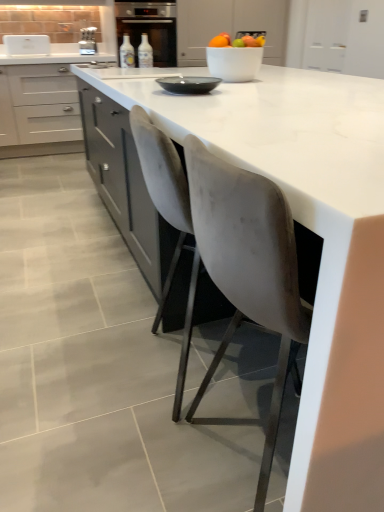
Question: Does metallic silver toaster at upper left turn towards matte black bowl at center?

Choices:
 (A) no
 (B) yes

Answer: (B)

Question: Is metallic silver toaster at upper left positioned beyond the bounds of matte black bowl at center?

Choices:
 (A) yes
 (B) no

Answer: (A)

Question: Is metallic silver toaster at upper left taller than matte black bowl at center?

Choices:
 (A) no
 (B) yes

Answer: (B)

Question: Is metallic silver toaster at upper left to the left of matte black bowl at center from the viewer's perspective?

Choices:
 (A) no
 (B) yes

Answer: (B)

Question: Considering the relative positions of metallic silver toaster at upper left and matte black bowl at center in the image provided, is metallic silver toaster at upper left to the right of matte black bowl at center from the viewer's perspective?

Choices:
 (A) no
 (B) yes

Answer: (A)

Question: From the image's perspective, is white glossy bowl at upper center positioned above or below translucent glass bottle at center, the second bottle from the right?

Choices:
 (A) below
 (B) above

Answer: (A)

Question: Considering their positions, is white glossy bowl at upper center located in front of or behind translucent glass bottle at center, the first bottle positioned from the left?

Choices:
 (A) front
 (B) behind

Answer: (A)

Question: Based on their positions, is white glossy bowl at upper center located to the left or right of translucent glass bottle at center, the second bottle from the right?

Choices:
 (A) right
 (B) left

Answer: (A)

Question: From a real-world perspective, is white glossy bowl at upper center physically located above or below translucent glass bottle at center, the second bottle from the right?

Choices:
 (A) above
 (B) below

Answer: (B)

Question: Considering the positions of point (147, 38) and point (178, 76), is point (147, 38) closer or farther from the camera than point (178, 76)?

Choices:
 (A) closer
 (B) farther

Answer: (B)

Question: In the image, is translucent glass bottle at center, the first bottle viewed from the right, on the left side or the right side of matte black bowl at center?

Choices:
 (A) right
 (B) left

Answer: (B)

Question: In the image, is translucent glass bottle at center, the first bottle viewed from the right, positioned in front of or behind matte black bowl at center?

Choices:
 (A) front
 (B) behind

Answer: (B)

Question: From the image's perspective, relative to matte black bowl at center, is translucent glass bottle at center, which ranks as the second bottle in left-to-right order, above or below?

Choices:
 (A) below
 (B) above

Answer: (B)

Question: In terms of height, does translucent glass bottle at center, the first bottle viewed from the right, look taller or shorter compared to metallic silver toaster at upper left?

Choices:
 (A) short
 (B) tall

Answer: (A)

Question: Considering the positions of translucent glass bottle at center, the first bottle viewed from the right, and metallic silver toaster at upper left in the image, is translucent glass bottle at center, the first bottle viewed from the right, wider or thinner than metallic silver toaster at upper left?

Choices:
 (A) thin
 (B) wide

Answer: (A)